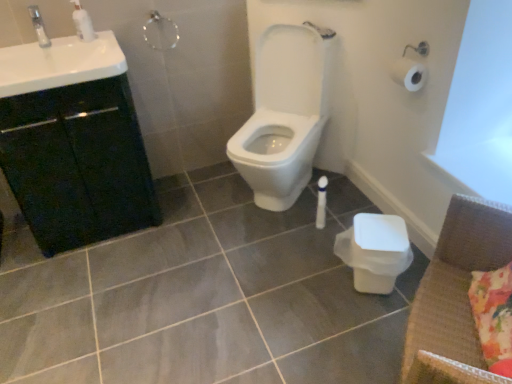
Question: From the image's perspective, is white glossy sink at upper left above or below white plastic toilet bowl at lower right?

Choices:
 (A) below
 (B) above

Answer: (B)

Question: Is white glossy sink at upper left to the left or to the right of white plastic toilet bowl at lower right in the image?

Choices:
 (A) right
 (B) left

Answer: (B)

Question: Based on their relative distances, which object is nearer to the white glossy toilet at center?

Choices:
 (A) white plastic toilet bowl at lower right
 (B) white glossy soap dispenser at upper left
 (C) fluffy floral pillow at lower right
 (D) gray glossy tile at center
 (E) clear plastic faucet at upper left

Answer: (D)

Question: Which object is positioned closest to the white glossy sink at upper left?

Choices:
 (A) white plastic toilet bowl at lower right
 (B) white glossy soap dispenser at upper left
 (C) brown woven armchair at lower right
 (D) clear plastic faucet at upper left
 (E) fluffy floral pillow at lower right

Answer: (B)